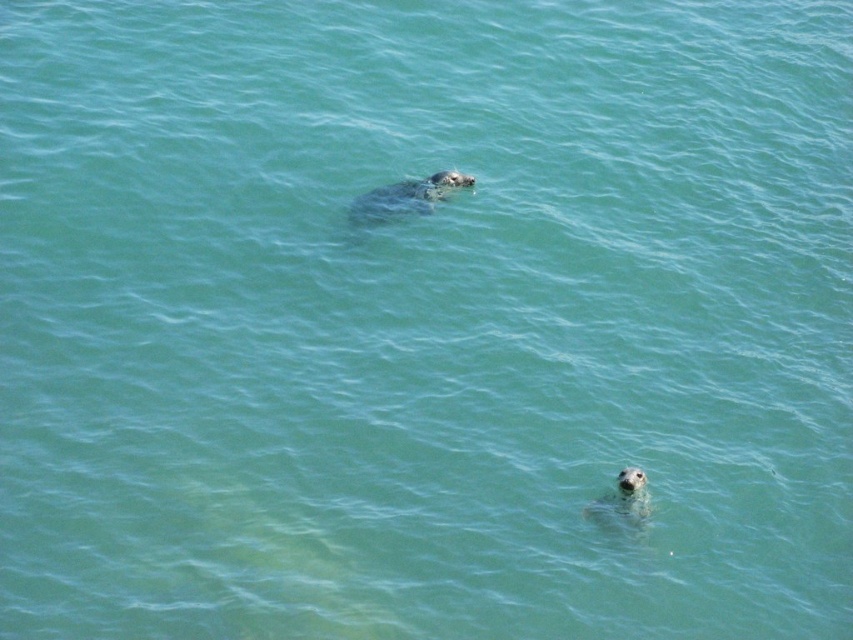
You are a marine biologist observing two seals in the water. You need to determine which seal is closer to you. The seals are the gray fur seal at upper center and the gray matte seal at lower center. Which one is closer?

The gray fur seal at upper center is closer to the viewer than the gray matte seal at lower center.

You are standing at a point 328.54 feet away from the camera. You want to take a photo of the seal at point point (x=360, y=218). Is the seal within your camera range?

The point (x=360, y=218) is 328.54 feet away from the camera. Since you are standing at a point 328.54 feet away from the camera, you are at the same distance as the seal. Therefore, the seal at point (x=360, y=218) is within your camera range.